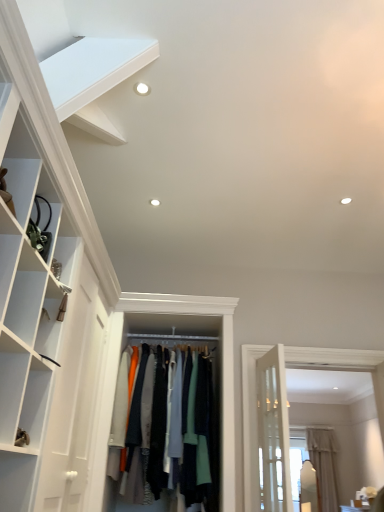
Question: Is beige fabric curtain at right aimed at white matte shelf at upper left?

Choices:
 (A) no
 (B) yes

Answer: (A)

Question: Is the depth of beige fabric curtain at right less than that of white matte shelf at upper left?

Choices:
 (A) yes
 (B) no

Answer: (B)

Question: Does beige fabric curtain at right have a greater width compared to white matte shelf at upper left?

Choices:
 (A) yes
 (B) no

Answer: (A)

Question: Is beige fabric curtain at right thinner than white matte shelf at upper left?

Choices:
 (A) no
 (B) yes

Answer: (A)

Question: From the image's perspective, is beige fabric curtain at right below white matte shelf at upper left?

Choices:
 (A) yes
 (B) no

Answer: (A)

Question: Looking at their shapes, would you say beige fabric curtain at right is wider or thinner than knit fabric sweater at center?

Choices:
 (A) wide
 (B) thin

Answer: (B)

Question: Would you say beige fabric curtain at right is inside or outside knit fabric sweater at center?

Choices:
 (A) outside
 (B) inside

Answer: (A)

Question: In terms of size, does beige fabric curtain at right appear bigger or smaller than knit fabric sweater at center?

Choices:
 (A) big
 (B) small

Answer: (B)

Question: Does point (332, 496) appear closer or farther from the camera than point (183, 486)?

Choices:
 (A) closer
 (B) farther

Answer: (B)

Question: Would you say knit fabric sweater at center is inside or outside white matte shelf at upper left?

Choices:
 (A) inside
 (B) outside

Answer: (B)

Question: In the image, is knit fabric sweater at center on the left side or the right side of white matte shelf at upper left?

Choices:
 (A) left
 (B) right

Answer: (B)

Question: Is knit fabric sweater at center in front of or behind white matte shelf at upper left in the image?

Choices:
 (A) front
 (B) behind

Answer: (B)

Question: Based on their sizes in the image, would you say knit fabric sweater at center is bigger or smaller than white matte shelf at upper left?

Choices:
 (A) big
 (B) small

Answer: (A)

Question: In the image, is white matte shelf at upper left on the left side or the right side of beige fabric curtain at right?

Choices:
 (A) right
 (B) left

Answer: (B)

Question: Does point (140, 50) appear closer or farther from the camera than point (331, 458)?

Choices:
 (A) farther
 (B) closer

Answer: (B)